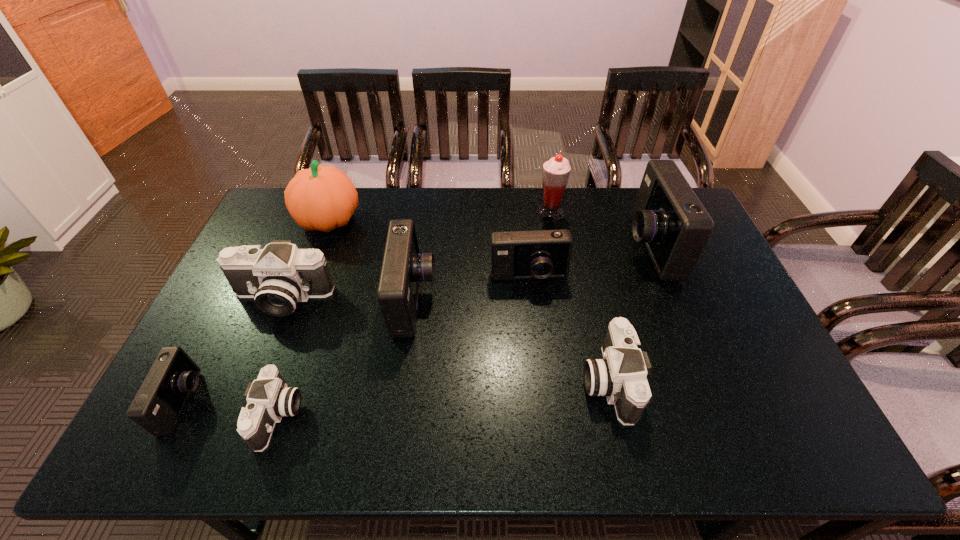
Where is `vacant area that satisfies the following two spatial constraints: 1. on the front-facing side of the rightmost object; 2. on the front-facing side of the second blue camera from right to left`? This screenshot has width=960, height=540. vacant area that satisfies the following two spatial constraints: 1. on the front-facing side of the rightmost object; 2. on the front-facing side of the second blue camera from right to left is located at coordinates (661, 278).

You are a GUI agent. You are given a task and a screenshot of the screen. Output one action in this format:
    pyautogui.click(x=<x>, y=<y>)
    Task: Click on the vacant region that satisfies the following two spatial constraints: 1. on the back side of the farthest black camera; 2. on the left side of the pumpkin
    
    Given the screenshot: What is the action you would take?
    pyautogui.click(x=313, y=221)

The image size is (960, 540). I want to click on vacant space that satisfies the following two spatial constraints: 1. on the back side of the second smallest black camera; 2. on the front-facing side of the third smallest blue camera, so click(589, 300).

The width and height of the screenshot is (960, 540). Find the location of `vacant region that satisfies the following two spatial constraints: 1. on the front side of the second biggest black camera; 2. on the right side of the smoothie`. vacant region that satisfies the following two spatial constraints: 1. on the front side of the second biggest black camera; 2. on the right side of the smoothie is located at coordinates (581, 381).

I want to click on free space that satisfies the following two spatial constraints: 1. on the back side of the rightmost black camera; 2. on the front-facing side of the fourth camera from right to left, so click(589, 300).